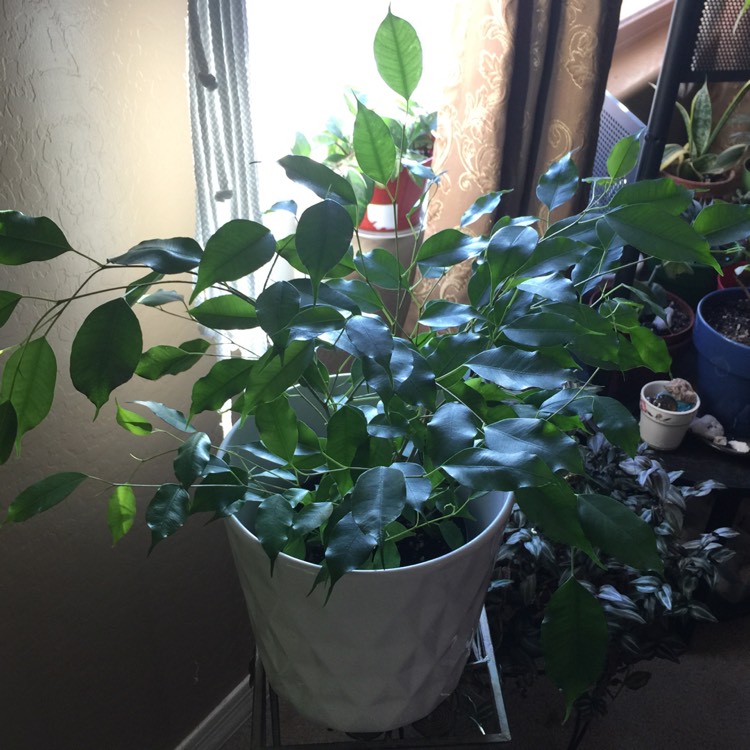
At what (x,y) coordinates should I click in order to perform the action: click on window. Please return your answer as a coordinate pair (x, y). This screenshot has height=750, width=750. Looking at the image, I should click on (631, 6).